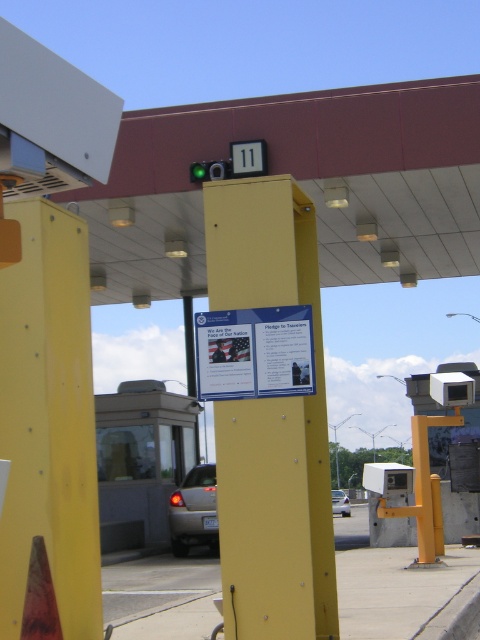
You are a driver approaching the toll booth and need to determine your position relative to two specific points marked in the scene. The first point is at coordinates point (177, 544), and the second is at point (336, 513). Based on the scene description, which point is closer to you as you approach the toll booth?

Point (177, 544) is closer to you because it is in front of point (336, 513), meaning it lies along your path towards the toll booth.

You are a driver approaching the toll booth and see the yellow matte signpost at center and the satin silver sedan at lower center. Which object is closer to you from your perspective?

The yellow matte signpost at center is positioned over the satin silver sedan at lower center, meaning it is closer to you than the sedan.